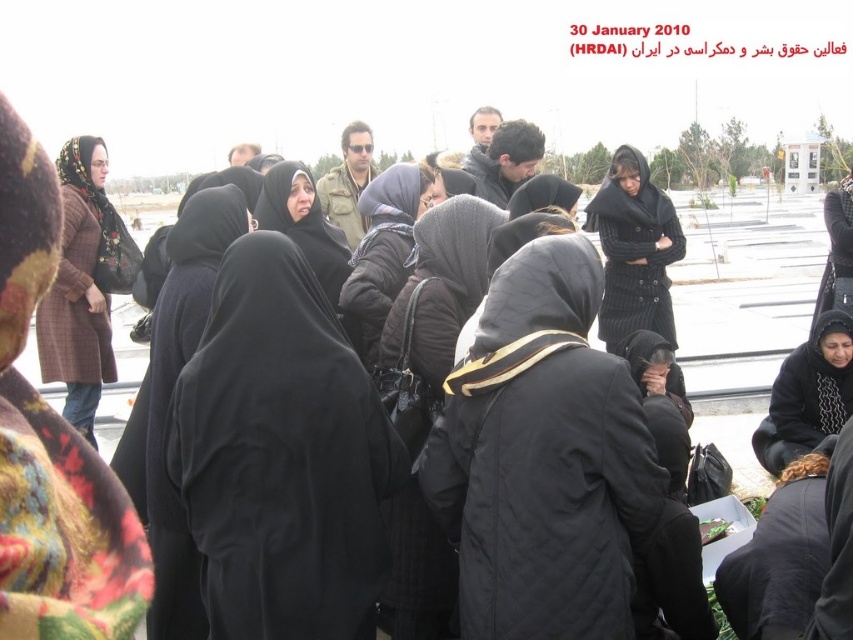
Can you confirm if black knitted sweater at center is positioned to the right of black fabric headscarf at center?

Yes, black knitted sweater at center is to the right of black fabric headscarf at center.

Can you confirm if black knitted sweater at center is thinner than black fabric headscarf at center?

No.

The width and height of the screenshot is (853, 640). What are the coordinates of `black knitted sweater at center` in the screenshot? It's located at (634, 250).

Locate an element on the screen. This screenshot has width=853, height=640. black knitted sweater at center is located at coordinates (634, 250).

Can you confirm if brown knitted coat at left is positioned to the right of black knitted sweater at center?

No, brown knitted coat at left is not to the right of black knitted sweater at center.

This screenshot has width=853, height=640. What do you see at coordinates (84, 284) in the screenshot?
I see `brown knitted coat at left` at bounding box center [84, 284].

The width and height of the screenshot is (853, 640). What are the coordinates of `brown knitted coat at left` in the screenshot? It's located at (84, 284).

Does black knitted sweater at center appear on the right side of black quilted jacket at center?

Yes, black knitted sweater at center is to the right of black quilted jacket at center.

Who is more distant from viewer, (645, 307) or (381, 189)?

Point (645, 307)

Image resolution: width=853 pixels, height=640 pixels. Find the location of `black knitted sweater at center`. black knitted sweater at center is located at coordinates (634, 250).